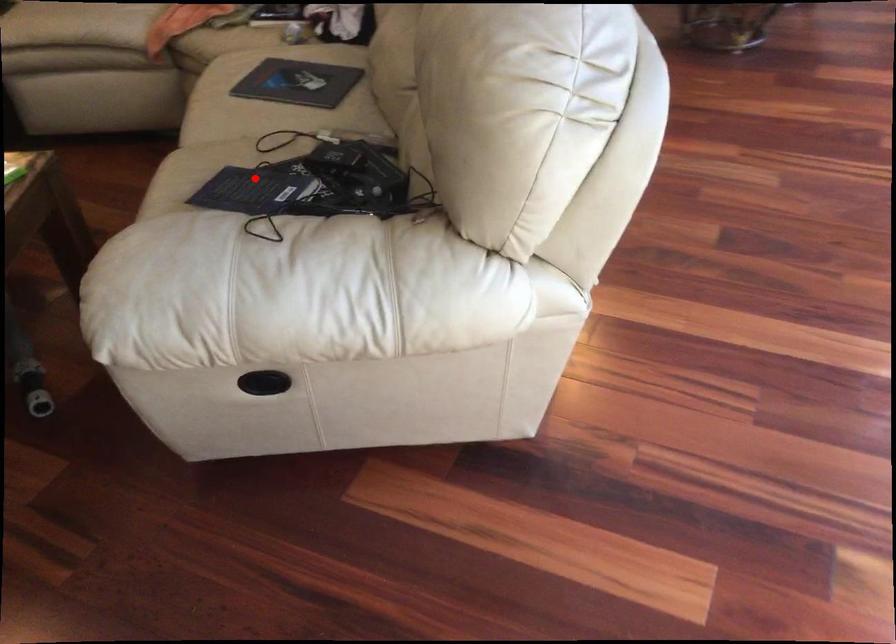
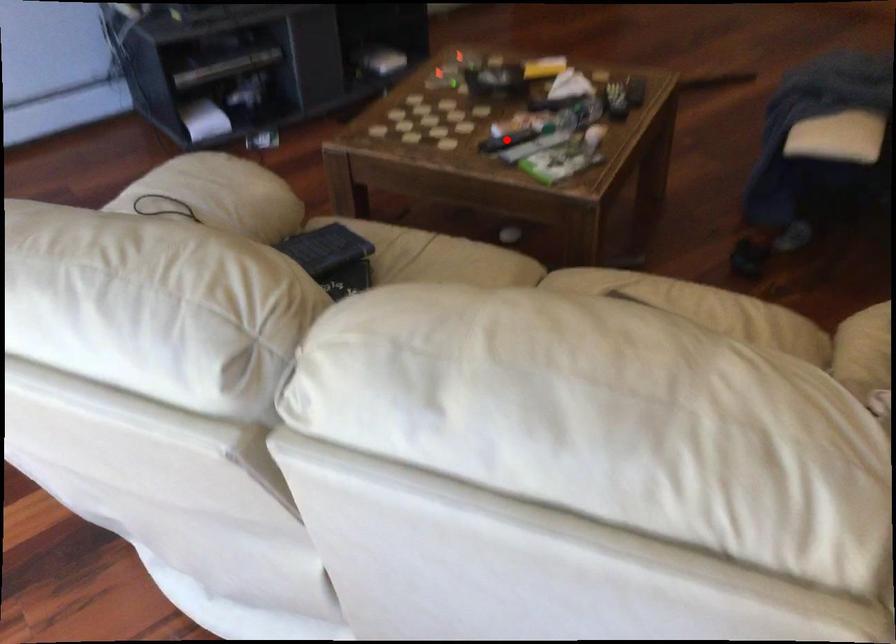
I am providing you with two images of the same scene from different viewpoints. A red point is marked on the first image and another point is marked on the second image. Is the marked point in image1 the same physical position as the marked point in image2?

No